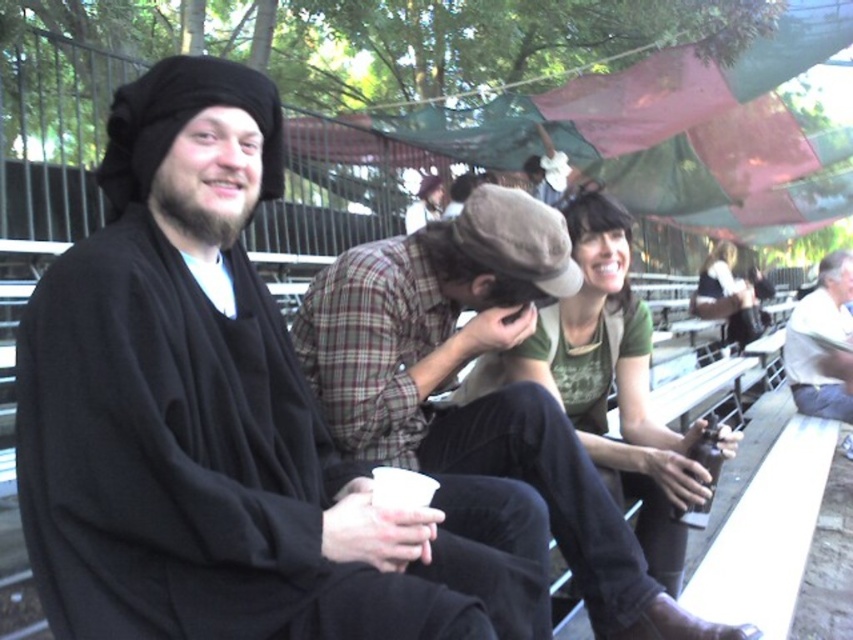
Question: Can you confirm if plaid shirt at center is bigger than light brown leather jacket at right?

Choices:
 (A) yes
 (B) no

Answer: (B)

Question: Considering the relative positions of black matte robe at left and matte green shirt at center in the image provided, where is black matte robe at left located with respect to matte green shirt at center?

Choices:
 (A) right
 (B) left

Answer: (B)

Question: Where is light brown leather jacket at right located in relation to matte green shirt at center in the image?

Choices:
 (A) right
 (B) left

Answer: (B)

Question: Which point is farther to the camera?

Choices:
 (A) light brown leather jacket at right
 (B) black matte robe at left
 (C) green matte shirt at center

Answer: (A)

Question: Which of these objects is positioned closest to the light brown leather jacket at right?

Choices:
 (A) green matte shirt at center
 (B) plaid shirt at center
 (C) matte green shirt at center

Answer: (A)

Question: Which of the following is the farthest from the observer?

Choices:
 (A) (527, 394)
 (B) (792, 368)

Answer: (B)